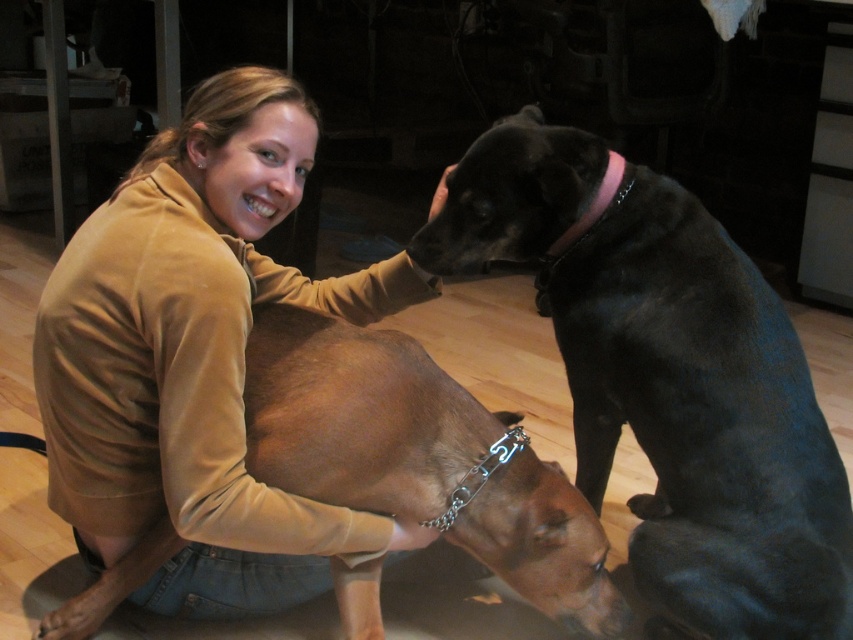
Looking at this image, who is positioned more to the right, matte brown jacket at center or brown leather dog at center?

Positioned to the right is brown leather dog at center.

Is matte brown jacket at center thinner than brown leather dog at center?

Incorrect, matte brown jacket at center's width is not less than brown leather dog at center's.

Between point (115, 544) and point (572, 545), which one is positioned in front?

Positioned in front is point (115, 544).

Where is `matte brown jacket at center`? matte brown jacket at center is located at coordinates (196, 358).

Can you confirm if brown leather dog at center is shorter than pink fabric neckband at upper right?

Incorrect, brown leather dog at center's height does not fall short of pink fabric neckband at upper right's.

Which is behind, point (379, 356) or point (610, 195)?

Point (610, 195)

Who is more forward, (587, 593) or (544, 252)?

Point (587, 593)

Identify the location of brown leather dog at center. (418, 456).

Between point (602, 492) and point (593, 202), which one is positioned in front?

Point (593, 202)

This screenshot has height=640, width=853. Describe the element at coordinates (703, 420) in the screenshot. I see `black smooth dog at center` at that location.

Does point (624, 385) come farther from viewer compared to point (585, 221)?

Yes, it is behind point (585, 221).

Locate an element on the screen. The image size is (853, 640). black smooth dog at center is located at coordinates (703, 420).